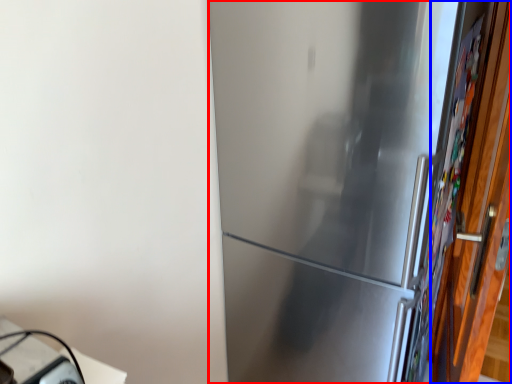
Question: Which object is closer to the camera taking this photo, refrigerator (highlighted by a red box) or door (highlighted by a blue box)?

Choices:
 (A) refrigerator
 (B) door

Answer: (B)